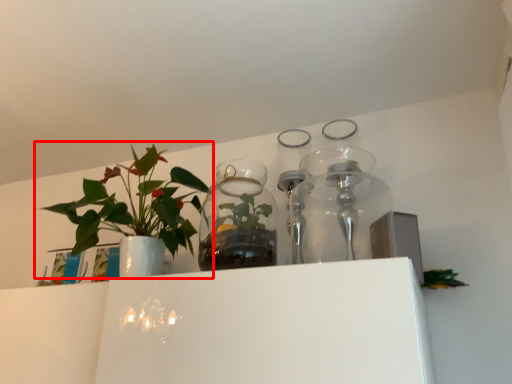
Question: From the image's perspective, considering the relative positions of houseplant (annotated by the red box) and vase in the image provided, where is houseplant (annotated by the red box) located with respect to the staircase?

Choices:
 (A) above
 (B) below

Answer: (A)